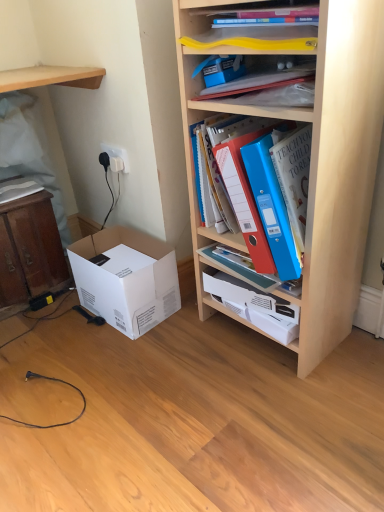
Identify the location of vacant region to the left of white cardboard box at lower left. This screenshot has height=512, width=384. (57, 329).